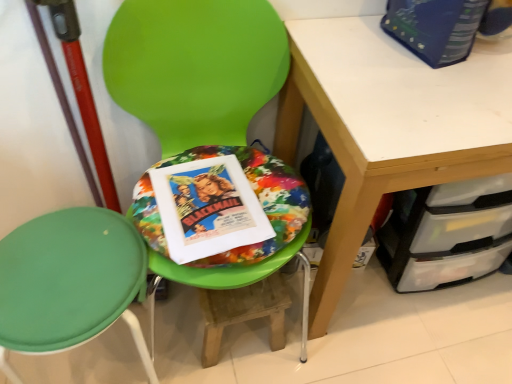
Locate an element on the screen. free point above matte paper movie poster at center, the 2th paperback book from the right (from a real-world perspective) is located at coordinates (209, 201).